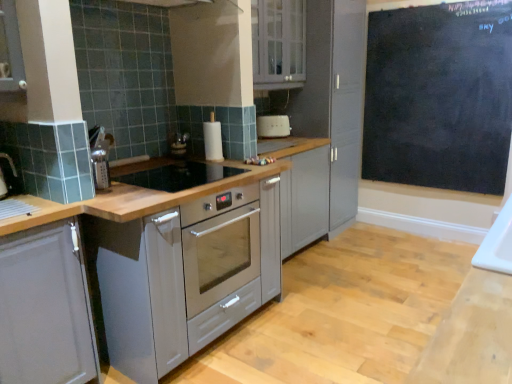
At what (x,y) coordinates should I click in order to perform the action: click on free spot above white plastic toaster at center (from a real-world perspective). Please return your answer as a coordinate pair (x, y). The width and height of the screenshot is (512, 384). Looking at the image, I should click on (272, 109).